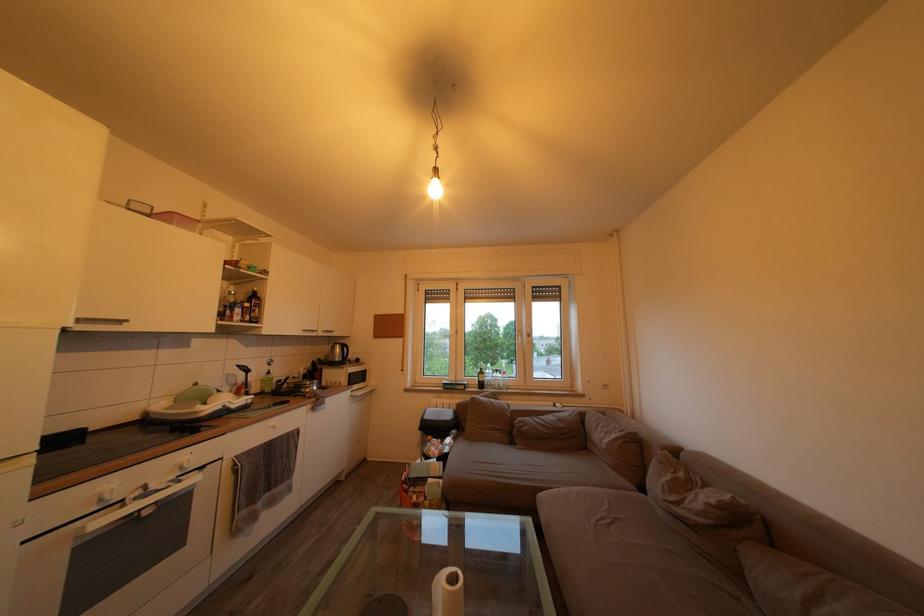
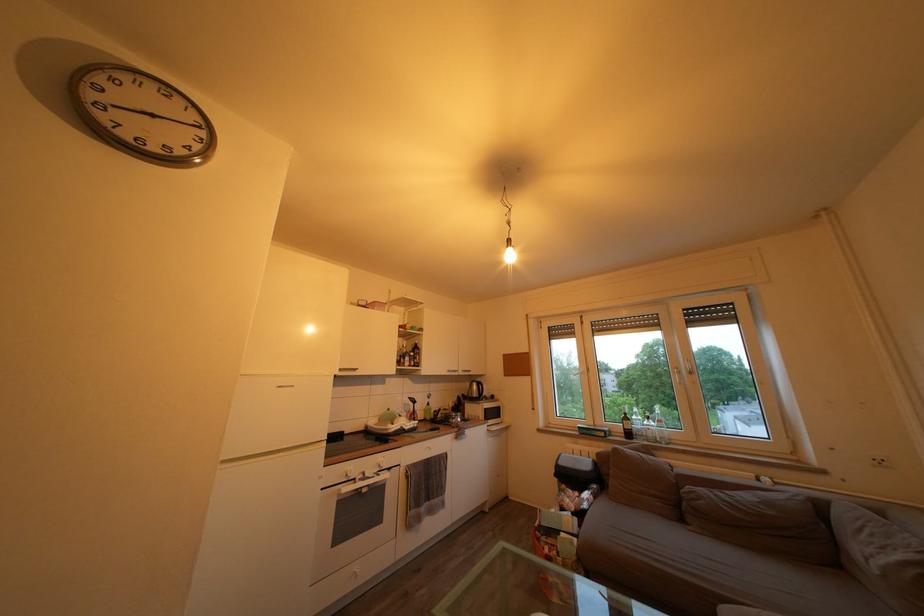
Where in the second image is the point corresponding to point 162,493 from the first image?

(375, 480)